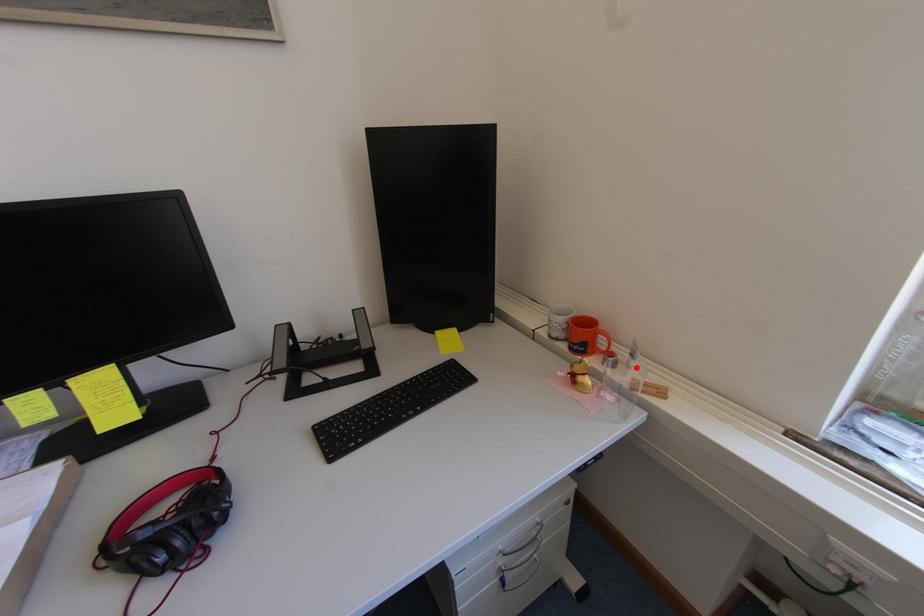
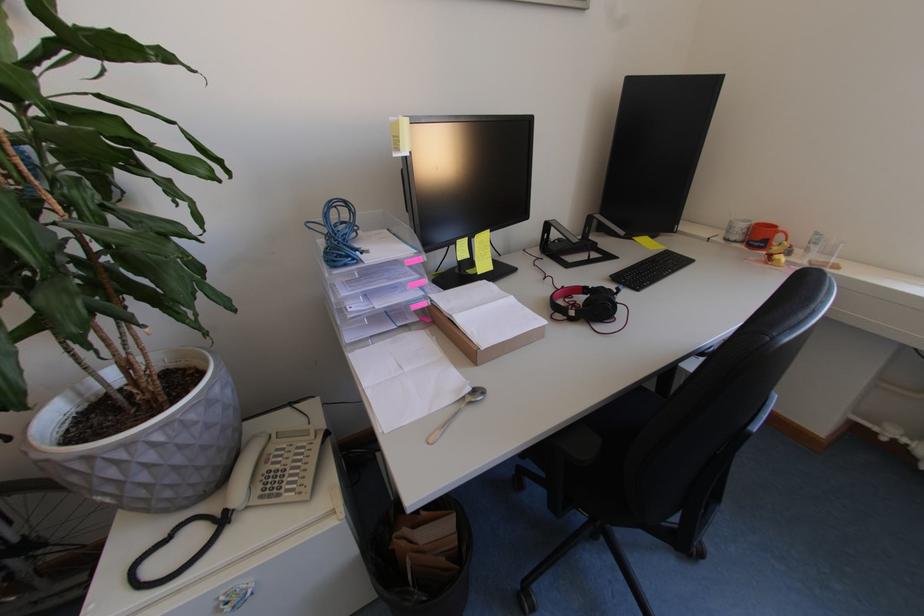
Where in the second image is the point corresponding to the highlighted location from the first image?

(816, 253)